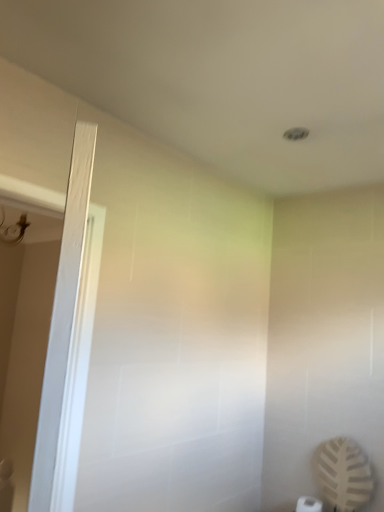
What is the approximate width of white matte toilet paper at lower right?

white matte toilet paper at lower right is 17.85 centimeters wide.

What do you see at coordinates (309, 504) in the screenshot? I see `white matte toilet paper at lower right` at bounding box center [309, 504].

Identify the location of white matte toilet paper at lower right. This screenshot has width=384, height=512. (309, 504).

Measure the distance between point (x=306, y=498) and camera.

The depth of point (x=306, y=498) is 2.00 meters.

You are a GUI agent. You are given a task and a screenshot of the screen. Output one action in this format:
    pyautogui.click(x=<x>, y=<y>)
    Task: Click on the white wood screen door at left
    The image size is (384, 512).
    Given the screenshot: What is the action you would take?
    pyautogui.click(x=63, y=322)

What do you see at coordinates (63, 322) in the screenshot?
I see `white wood screen door at left` at bounding box center [63, 322].

Where is `white matte toilet paper at lower right`? This screenshot has height=512, width=384. white matte toilet paper at lower right is located at coordinates (309, 504).

Is white wood screen door at left to the left of white matte toilet paper at lower right from the viewer's perspective?

A: Yes, white wood screen door at left is to the left of white matte toilet paper at lower right.

Considering the positions of objects white wood screen door at left and white matte toilet paper at lower right in the image provided, who is in front, white wood screen door at left or white matte toilet paper at lower right?

white wood screen door at left is closer to the camera.

Between point (51, 391) and point (300, 511), which one is positioned behind?

The point (300, 511) is farther.

From the picture: From the image's perspective, which one is positioned lower, white wood screen door at left or white matte toilet paper at lower right?

white matte toilet paper at lower right is shown below in the image.

From a real-world perspective, which is physically below, white wood screen door at left or white matte toilet paper at lower right?

In real-world perspective, white matte toilet paper at lower right is lower.

Is white wood screen door at left wider or thinner than white matte toilet paper at lower right?

A: Considering their sizes, white wood screen door at left looks slimmer than white matte toilet paper at lower right.

Who is shorter, white wood screen door at left or white matte toilet paper at lower right?

white matte toilet paper at lower right is shorter.

Looking at this image, considering the relative sizes of white wood screen door at left and white matte toilet paper at lower right in the image provided, is white wood screen door at left smaller than white matte toilet paper at lower right?

Incorrect, white wood screen door at left is not smaller in size than white matte toilet paper at lower right.

Choose the correct answer: Is white wood screen door at left inside white matte toilet paper at lower right or outside it?

white wood screen door at left is outside white matte toilet paper at lower right.

Is white wood screen door at left positioned far away from white matte toilet paper at lower right?

white wood screen door at left is positioned a significant distance from white matte toilet paper at lower right.

Looking at this image, is white matte toilet paper at lower right at the back of white wood screen door at left?

Yes, white wood screen door at left's orientation is away from white matte toilet paper at lower right.

What's the angular difference between white wood screen door at left and white matte toilet paper at lower right's facing directions?

The facing directions of white wood screen door at left and white matte toilet paper at lower right are 38.3 degrees apart.

How distant is white wood screen door at left from white matte toilet paper at lower right?

white wood screen door at left and white matte toilet paper at lower right are 5.79 feet apart from each other.

Where is `screen door located above the white matte toilet paper at lower right (from a real-world perspective)`? The image size is (384, 512). screen door located above the white matte toilet paper at lower right (from a real-world perspective) is located at coordinates (63, 322).

Is white matte toilet paper at lower right to the right of white wood screen door at left from the viewer's perspective?

Yes.

Considering the positions of objects white matte toilet paper at lower right and white wood screen door at left in the image provided, who is behind, white matte toilet paper at lower right or white wood screen door at left?

white matte toilet paper at lower right is further away from the camera.

Does point (297, 508) lie in front of point (66, 309)?

No, (297, 508) is further to viewer.

From the image's perspective, which is above, white matte toilet paper at lower right or white wood screen door at left?

white wood screen door at left.

From a real-world perspective, which object stands above the other?

white wood screen door at left, from a real-world perspective.

Is white matte toilet paper at lower right thinner than white wood screen door at left?

No.

From their relative heights in the image, would you say white matte toilet paper at lower right is taller or shorter than white wood screen door at left?

Clearly, white matte toilet paper at lower right is shorter compared to white wood screen door at left.

Which of these two, white matte toilet paper at lower right or white wood screen door at left, is smaller?

Smaller between the two is white matte toilet paper at lower right.

Which is correct: white matte toilet paper at lower right is inside white wood screen door at left, or outside of it?

white matte toilet paper at lower right is not enclosed by white wood screen door at left.

Would you consider white matte toilet paper at lower right to be distant from white wood screen door at left?

Indeed, white matte toilet paper at lower right is not near white wood screen door at left.

Is white matte toilet paper at lower right positioned with its back to white wood screen door at left?

No, white matte toilet paper at lower right is not facing the opposite direction of white wood screen door at left.

How different are the orientations of white matte toilet paper at lower right and white wood screen door at left in degrees?

They differ by 38.3 degrees in their facing directions.

Identify the location of screen door that appears above the white matte toilet paper at lower right (from a real-world perspective). Image resolution: width=384 pixels, height=512 pixels. tap(63, 322).

The height and width of the screenshot is (512, 384). I want to click on screen door that appears above the white matte toilet paper at lower right (from a real-world perspective), so click(63, 322).

You are a GUI agent. You are given a task and a screenshot of the screen. Output one action in this format:
    pyautogui.click(x=<x>, y=<y>)
    Task: Click on the toilet paper behind the white wood screen door at left
    This screenshot has height=512, width=384.
    Given the screenshot: What is the action you would take?
    pyautogui.click(x=309, y=504)